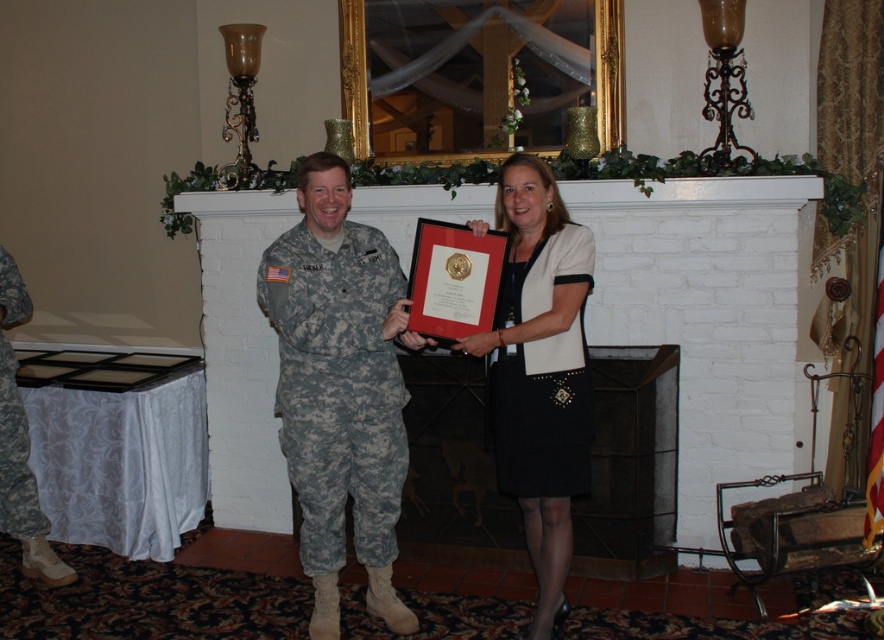
You are attending a formal ceremony and notice two people at the center of the stage. There is a camouflage uniform at center and a black satin dress at center. From your perspective, which one is positioned to the left?

The camouflage uniform at center is to the left of the black satin dress at center.